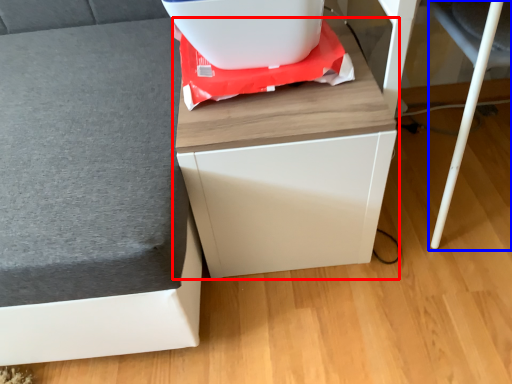
Question: Which point is further to the camera, furniture (highlighted by a red box) or swivel chair (highlighted by a blue box)?

Choices:
 (A) furniture
 (B) swivel chair

Answer: (A)